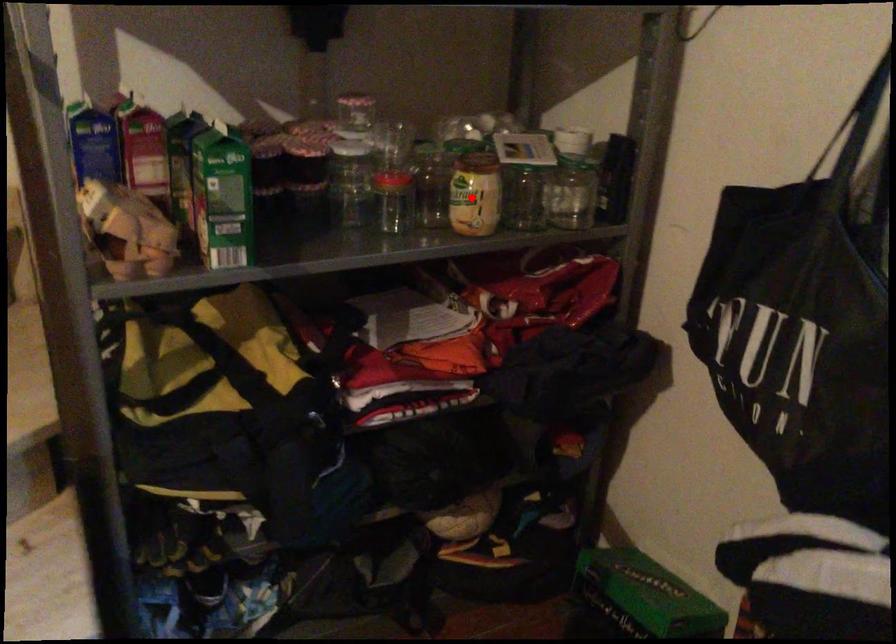
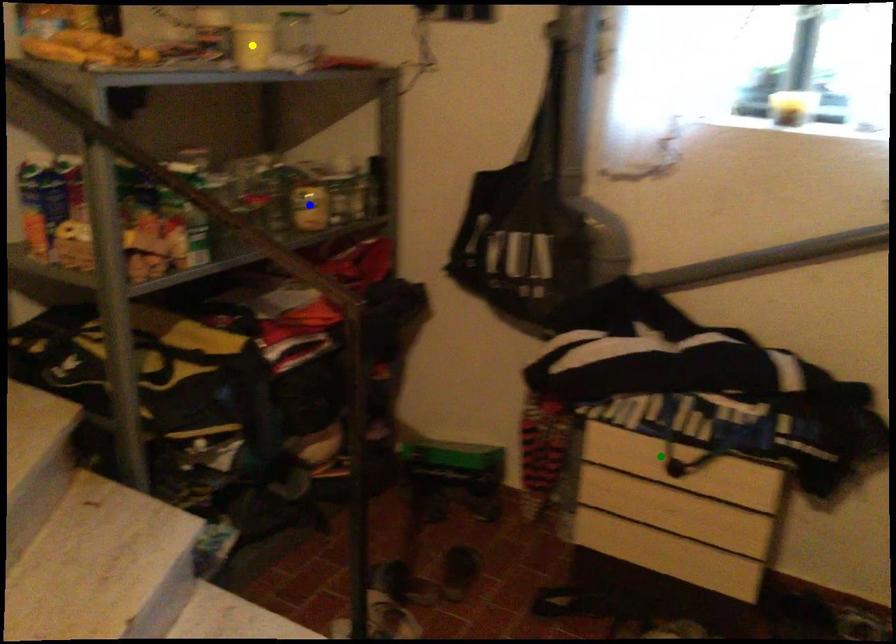
Question: I am providing you with two images of the same scene from different viewpoints. A red point is marked on the first image. You are given multiple points on the second image. In image 2, which mark is for the same physical point as the one in image 1?

Choices:
 (A) yellow point
 (B) blue point
 (C) green point

Answer: (B)